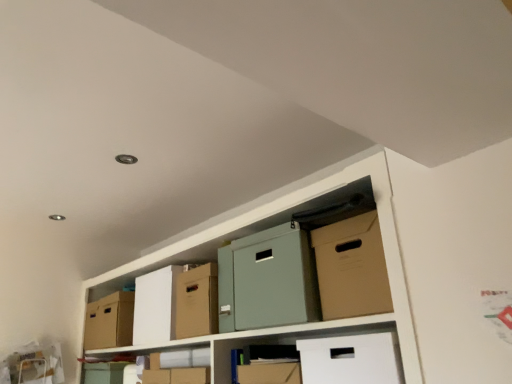
Describe the element at coordinates (351, 268) in the screenshot. I see `brown cardboard box at upper right, the third cardboard box when ordered from left to right` at that location.

This screenshot has width=512, height=384. Find the location of `brown cardboard box at upper right, which is the third cardboard box from back to front`. brown cardboard box at upper right, which is the third cardboard box from back to front is located at coordinates (351, 268).

From their relative heights in the image, would you say brown cardboard box at upper right, the third cardboard box when ordered from left to right, is taller or shorter than cardboard box at left, marked as the 3th cardboard box in a right-to-left arrangement?

Clearly, brown cardboard box at upper right, the third cardboard box when ordered from left to right, is taller compared to cardboard box at left, marked as the 3th cardboard box in a right-to-left arrangement.

From the image's perspective, is brown cardboard box at upper right, the third cardboard box when ordered from left to right, located above or below cardboard box at left, marked as the 3th cardboard box in a right-to-left arrangement?

Clearly, from the image's perspective, brown cardboard box at upper right, the third cardboard box when ordered from left to right, is above cardboard box at left, marked as the 3th cardboard box in a right-to-left arrangement.

Is brown cardboard box at upper right, the third cardboard box when ordered from left to right, aimed at cardboard box at left, placed as the 3th cardboard box when sorted from front to back?

No, brown cardboard box at upper right, the third cardboard box when ordered from left to right, is not oriented towards cardboard box at left, placed as the 3th cardboard box when sorted from front to back.

Can you tell me how much brown cardboard box at upper right, placed as the first cardboard box when sorted from front to back, and cardboard box at left, arranged as the 1th cardboard box when viewed from the left, differ in facing direction?

The angle between the facing direction of brown cardboard box at upper right, placed as the first cardboard box when sorted from front to back, and the facing direction of cardboard box at left, arranged as the 1th cardboard box when viewed from the left, is 0.00159 degrees.

Are brown cardboard box at upper right, placed as the first cardboard box when sorted from front to back, and cardboard box at center, which is the 2th cardboard box from back to front, beside each other?

No.

Can you confirm if brown cardboard box at upper right, placed as the 1th cardboard box when sorted from right to left, is bigger than cardboard box at center, marked as the second cardboard box in a right-to-left arrangement?

No, brown cardboard box at upper right, placed as the 1th cardboard box when sorted from right to left, is not bigger than cardboard box at center, marked as the second cardboard box in a right-to-left arrangement.

In terms of height, does brown cardboard box at upper right, placed as the first cardboard box when sorted from front to back, look taller or shorter compared to cardboard box at center, placed as the second cardboard box when sorted from front to back?

In the image, brown cardboard box at upper right, placed as the first cardboard box when sorted from front to back, appears to be shorter than cardboard box at center, placed as the second cardboard box when sorted from front to back.

Would you say brown cardboard box at upper right, placed as the first cardboard box when sorted from front to back, is to the left or to the right of matte cardboard box at lower center in the picture?

brown cardboard box at upper right, placed as the first cardboard box when sorted from front to back, is to the right of matte cardboard box at lower center.

Is brown cardboard box at upper right, which is the third cardboard box from back to front, oriented towards matte cardboard box at lower center?

No, brown cardboard box at upper right, which is the third cardboard box from back to front, is not oriented towards matte cardboard box at lower center.

Locate an element on the screen. This screenshot has height=384, width=512. the 1st cardboard box directly above the matte cardboard box at lower center (from a real-world perspective) is located at coordinates (351, 268).

Is matte cardboard box at lower center turned away from brown cardboard box at upper right, which is the third cardboard box from back to front?

No.

Consider the image. Can you confirm if matte cardboard box at lower center is taller than brown cardboard box at upper right, which is the third cardboard box from back to front?

No, matte cardboard box at lower center is not taller than brown cardboard box at upper right, which is the third cardboard box from back to front.

In terms of width, does matte cardboard box at lower center look wider or thinner when compared to brown cardboard box at upper right, placed as the first cardboard box when sorted from front to back?

In the image, matte cardboard box at lower center appears to be wider than brown cardboard box at upper right, placed as the first cardboard box when sorted from front to back.

From the image's perspective, is cardboard box at left, placed as the 3th cardboard box when sorted from front to back, on cardboard box at center, placed as the second cardboard box when sorted from front to back?

No, from the image's perspective, cardboard box at left, placed as the 3th cardboard box when sorted from front to back, is not over cardboard box at center, placed as the second cardboard box when sorted from front to back.

Considering the positions of objects cardboard box at left, marked as the 3th cardboard box in a right-to-left arrangement, and cardboard box at center, placed as the second cardboard box when sorted from front to back, in the image provided, who is behind, cardboard box at left, marked as the 3th cardboard box in a right-to-left arrangement, or cardboard box at center, placed as the second cardboard box when sorted from front to back,?

cardboard box at left, marked as the 3th cardboard box in a right-to-left arrangement, is behind.

Is cardboard box at left, which is the first cardboard box from back to front, inside or outside of cardboard box at center, marked as the second cardboard box in a right-to-left arrangement?

cardboard box at left, which is the first cardboard box from back to front, is spatially situated outside cardboard box at center, marked as the second cardboard box in a right-to-left arrangement.

Is cardboard box at left, which is the first cardboard box from back to front, not close to cardboard box at center, marked as the second cardboard box in a right-to-left arrangement?

cardboard box at left, which is the first cardboard box from back to front, is actually quite close to cardboard box at center, marked as the second cardboard box in a right-to-left arrangement.

Is matte cardboard box at center facing away from cardboard box at left, arranged as the 1th cardboard box when viewed from the left?

That's not correct — matte cardboard box at center is not looking away from cardboard box at left, arranged as the 1th cardboard box when viewed from the left.

Is matte cardboard box at center bigger than cardboard box at left, placed as the 3th cardboard box when sorted from front to back?

Correct, matte cardboard box at center is larger in size than cardboard box at left, placed as the 3th cardboard box when sorted from front to back.

Is cardboard box at left, marked as the 3th cardboard box in a right-to-left arrangement, inside matte cardboard box at center?

No, cardboard box at left, marked as the 3th cardboard box in a right-to-left arrangement, is located outside of matte cardboard box at center.

Does matte cardboard box at center have a lesser height compared to cardboard box at left, placed as the 3th cardboard box when sorted from front to back?

In fact, matte cardboard box at center may be taller than cardboard box at left, placed as the 3th cardboard box when sorted from front to back.

How many degrees apart are the facing directions of matte cardboard box at lower center and cardboard box at center, placed as the second cardboard box when sorted from front to back?

The facing directions of matte cardboard box at lower center and cardboard box at center, placed as the second cardboard box when sorted from front to back, are 0.00061 degrees apart.

Is matte cardboard box at lower center thinner than cardboard box at center, placed as the second cardboard box when sorted from front to back?

Incorrect, the width of matte cardboard box at lower center is not less than that of cardboard box at center, placed as the second cardboard box when sorted from front to back.

Can we say matte cardboard box at lower center lies outside cardboard box at center, which is the 2th cardboard box from back to front?

Yes, matte cardboard box at lower center is not within cardboard box at center, which is the 2th cardboard box from back to front.

Which is closer, (111,378) or (135,304)?

Point (111,378).

The image size is (512, 384). Find the location of `the 1st cardboard box directly above the brown cardboard box at upper right, placed as the first cardboard box when sorted from front to back (from a real-world perspective)`. the 1st cardboard box directly above the brown cardboard box at upper right, placed as the first cardboard box when sorted from front to back (from a real-world perspective) is located at coordinates (110, 321).

At what (x,y) coordinates should I click in order to perform the action: click on cardboard box lying above the cardboard box at center, which is the 2th cardboard box from back to front (from the image's perspective). Please return your answer as a coordinate pair (x, y). This screenshot has height=384, width=512. Looking at the image, I should click on (351, 268).

When comparing their distances from brown cardboard box at upper right, the third cardboard box when ordered from left to right, does matte cardboard box at lower center or cardboard box at center, placed as the second cardboard box when sorted from front to back, seem closer?

cardboard box at center, placed as the second cardboard box when sorted from front to back, lies closer to brown cardboard box at upper right, the third cardboard box when ordered from left to right, than the other object.

Looking at the image, which one is located further to brown cardboard box at upper right, the third cardboard box when ordered from left to right, matte cardboard box at lower center or matte cardboard box at center?

Based on the image, matte cardboard box at lower center appears to be further to brown cardboard box at upper right, the third cardboard box when ordered from left to right.

Which object lies nearer to the anchor point matte cardboard box at center, cardboard box at center, which is the 2th cardboard box from back to front, or cardboard box at left, placed as the 3th cardboard box when sorted from front to back?

cardboard box at center, which is the 2th cardboard box from back to front.

Looking at the image, which one is located closer to cardboard box at left, marked as the 3th cardboard box in a right-to-left arrangement, matte cardboard box at lower center or brown cardboard box at upper right, which is the third cardboard box from back to front?

matte cardboard box at lower center is closer to cardboard box at left, marked as the 3th cardboard box in a right-to-left arrangement.

When comparing their distances from cardboard box at center, marked as the second cardboard box in a right-to-left arrangement, does cardboard box at left, marked as the 3th cardboard box in a right-to-left arrangement, or matte cardboard box at lower center seem closer?

Among the two, cardboard box at left, marked as the 3th cardboard box in a right-to-left arrangement, is located nearer to cardboard box at center, marked as the second cardboard box in a right-to-left arrangement.

Considering their positions, is brown cardboard box at upper right, placed as the first cardboard box when sorted from front to back, positioned further to cardboard box at left, placed as the 3th cardboard box when sorted from front to back, than cardboard box at center, the 2th cardboard box when ordered from left to right?

brown cardboard box at upper right, placed as the first cardboard box when sorted from front to back.

Considering their positions, is matte cardboard box at center positioned further to cardboard box at left, marked as the 3th cardboard box in a right-to-left arrangement, than matte cardboard box at lower center?

matte cardboard box at center is positioned further to the anchor cardboard box at left, marked as the 3th cardboard box in a right-to-left arrangement.

When comparing their distances from cardboard box at center, which is the 2th cardboard box from back to front, does matte cardboard box at center or matte cardboard box at lower center seem closer?

matte cardboard box at lower center is closer to cardboard box at center, which is the 2th cardboard box from back to front.

I want to click on box positioned between cardboard box at center, marked as the second cardboard box in a right-to-left arrangement, and cardboard box at left, marked as the 3th cardboard box in a right-to-left arrangement, from near to far, so (104, 372).

The image size is (512, 384). I want to click on wide between brown cardboard box at upper right, placed as the 1th cardboard box when sorted from right to left, and matte cardboard box at lower center, along the z-axis, so click(267, 280).

Find the location of a particular element. The image size is (512, 384). cardboard box between brown cardboard box at upper right, placed as the 1th cardboard box when sorted from right to left, and matte cardboard box at lower center in the front-back direction is located at coordinates (155, 306).

Where is `box located between matte cardboard box at center and cardboard box at left, marked as the 3th cardboard box in a right-to-left arrangement, in the depth direction`? The height and width of the screenshot is (384, 512). box located between matte cardboard box at center and cardboard box at left, marked as the 3th cardboard box in a right-to-left arrangement, in the depth direction is located at coordinates (104, 372).